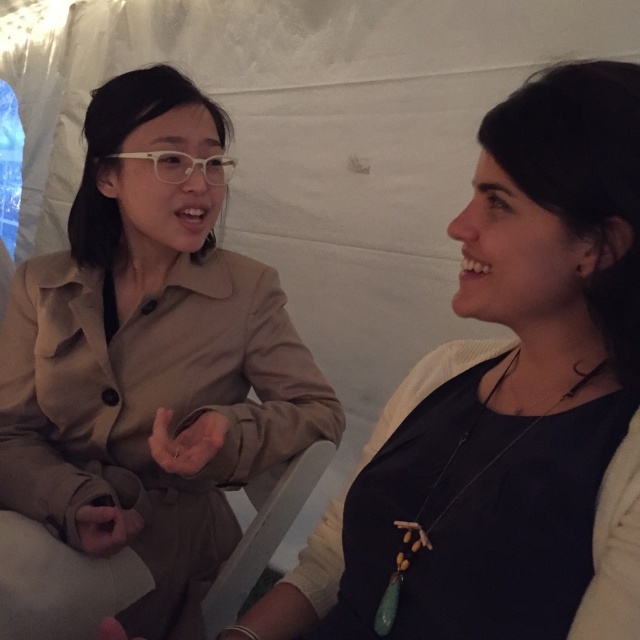
You are designing a display stand for a clothing store. You need to place the matte black sweater at center and the tan fabric coat at left. Given their height difference, which item should be placed on a higher shelf to ensure both items are visible?

The tan fabric coat at left should be placed on a higher shelf since it has greater height than the matte black sweater at center, allowing both items to be visible when displayed.